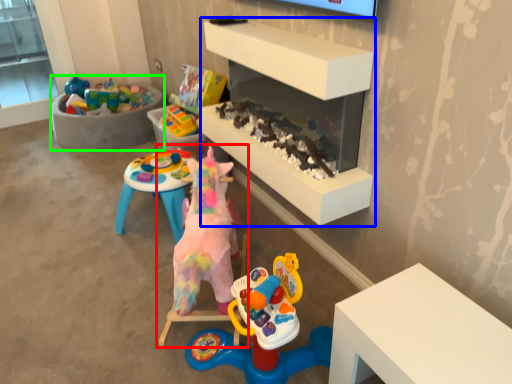
Question: Estimate the real-world distances between objects in this image. Which object is farther from toy (highlighted by a red box), shelf (highlighted by a blue box) or furniture (highlighted by a green box)?

Choices:
 (A) shelf
 (B) furniture

Answer: (B)